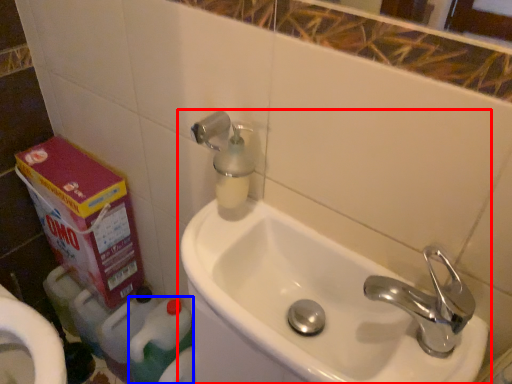
Question: Which object is further to the camera taking this photo, sink (highlighted by a red box) or cleaning product (highlighted by a blue box)?

Choices:
 (A) sink
 (B) cleaning product

Answer: (B)